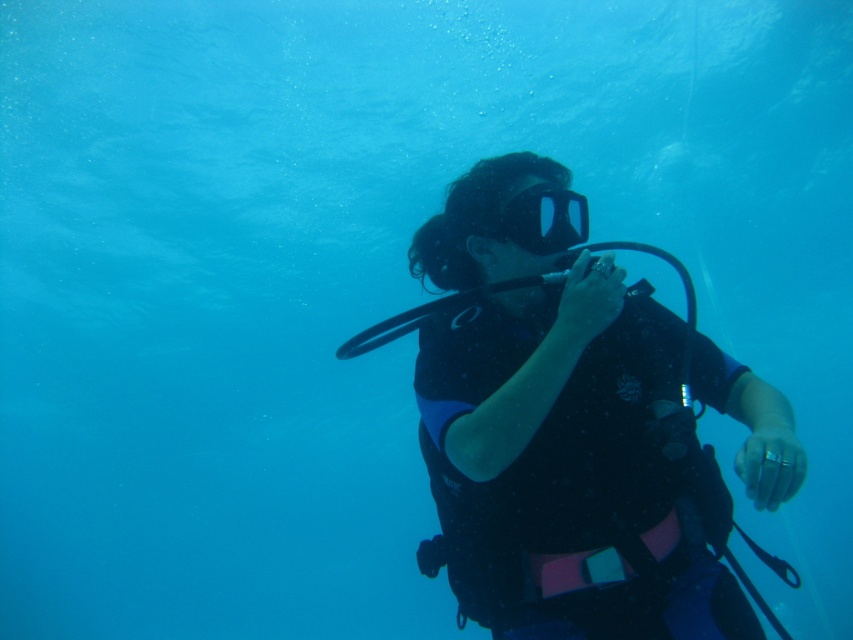
In the scene shown: Can you confirm if black matte scuba diver at center is taller than transparent rubber mask at center?

Correct, black matte scuba diver at center is much taller as transparent rubber mask at center.

Who is positioned more to the right, black matte scuba diver at center or transparent rubber mask at center?

From the viewer's perspective, black matte scuba diver at center appears more on the right side.

Identify the location of black matte scuba diver at center. (569, 467).